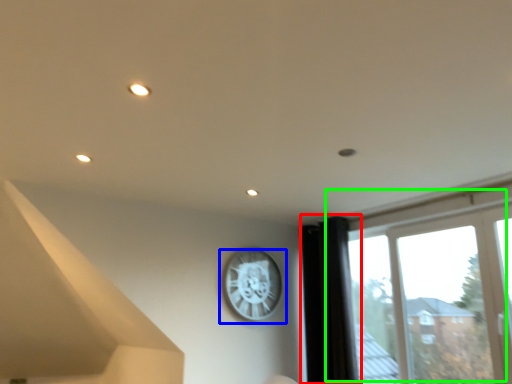
Question: Based on their relative distances, which object is nearer to curtain (highlighted by a red box)? Choose from wall clock (highlighted by a blue box) and window (highlighted by a green box).

Choices:
 (A) wall clock
 (B) window

Answer: (B)